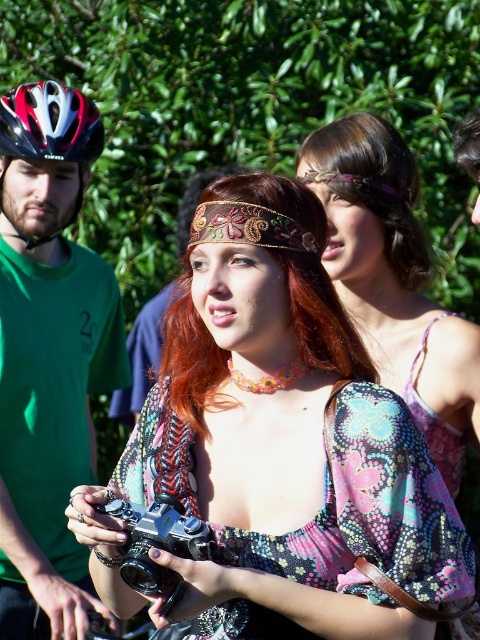
You are at an outdoor event and need to locate the brownhair at center. Which direction should you look relative to the matte black helmet at left?

The matte black helmet at left is positioned on the left side of brownhair at center, so to locate the brownhair at center, you should look to the right from the matte black helmet at left.